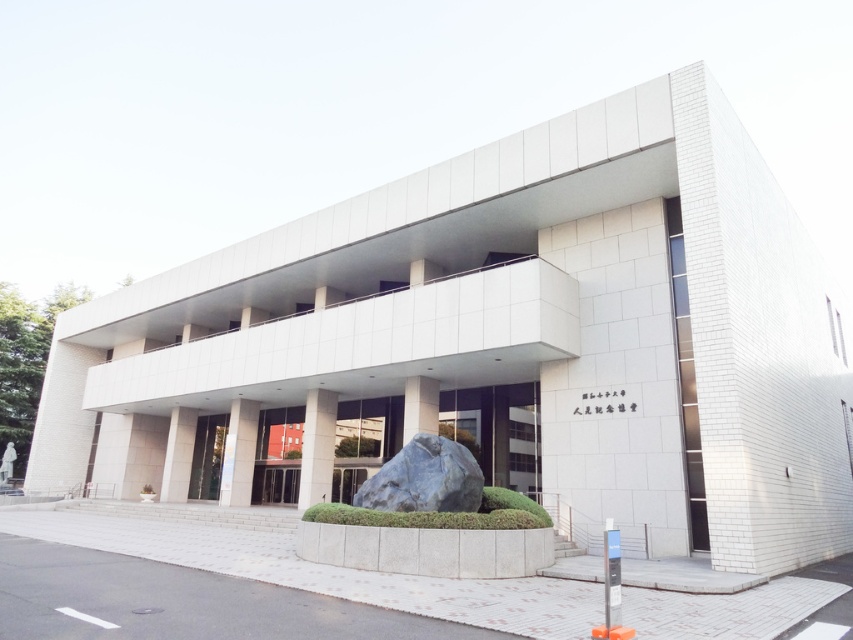
Which is more to the right, gray polished stone boulder at center or white glass door at center?

From the viewer's perspective, white glass door at center appears more on the right side.

Can you confirm if gray polished stone boulder at center is thinner than white glass door at center?

No, gray polished stone boulder at center is not thinner than white glass door at center.

Where is `gray polished stone boulder at center`? Image resolution: width=853 pixels, height=640 pixels. gray polished stone boulder at center is located at coordinates (424, 477).

What do you see at coordinates (497, 433) in the screenshot? I see `smooth glass door at center` at bounding box center [497, 433].

Can you confirm if smooth glass door at center is thinner than glossy glass door at center?

No, smooth glass door at center is not thinner than glossy glass door at center.

Is point (466, 394) positioned before point (212, 444)?

Yes, it is.

At what (x,y) coordinates should I click in order to perform the action: click on smooth glass door at center. Please return your answer as a coordinate pair (x, y). The width and height of the screenshot is (853, 640). Looking at the image, I should click on (497, 433).

Is gray polished stone boulder at center thinner than glossy glass door at center?

No.

In the scene shown: Does gray polished stone boulder at center have a greater height compared to glossy glass door at center?

No, gray polished stone boulder at center is not taller than glossy glass door at center.

Between point (361, 486) and point (190, 490), which one is positioned behind?

Positioned behind is point (190, 490).

Image resolution: width=853 pixels, height=640 pixels. Identify the location of gray polished stone boulder at center. (424, 477).